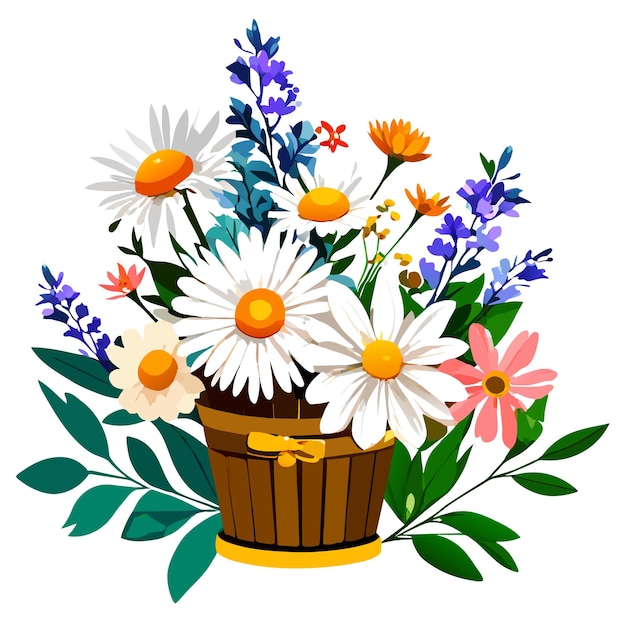
The height and width of the screenshot is (626, 626). In order to click on yellow base of basket in this screenshot , I will do `click(290, 558)`.